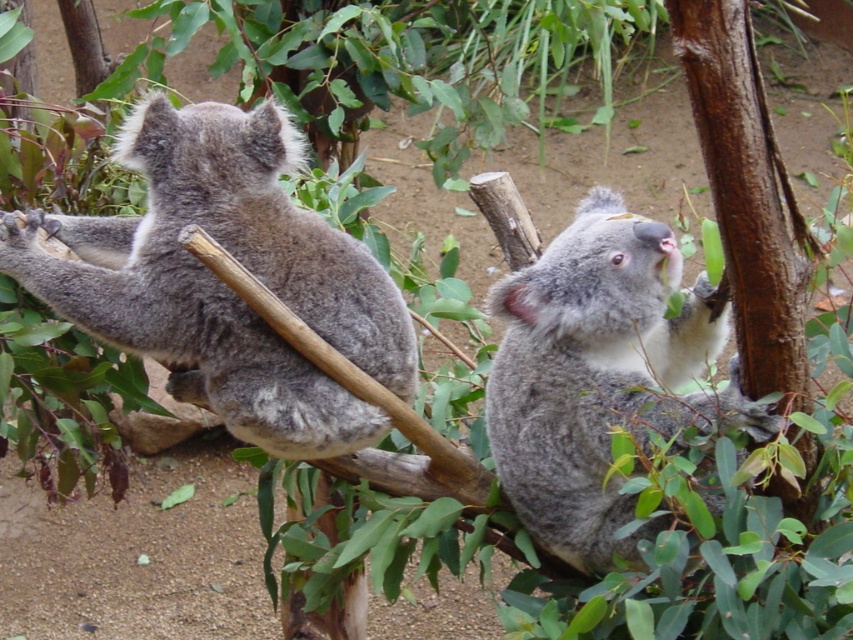
Question: Can you confirm if gray furry koala at left is thinner than fuzzy gray koala at upper right?

Choices:
 (A) yes
 (B) no

Answer: (B)

Question: Which of the following is the farthest from the observer?

Choices:
 (A) fuzzy gray koala at upper right
 (B) gray furry koala at left

Answer: (B)

Question: Can you confirm if gray furry koala at left is wider than fuzzy gray koala at upper right?

Choices:
 (A) no
 (B) yes

Answer: (B)

Question: Is gray furry koala at left below fuzzy gray koala at upper right?

Choices:
 (A) no
 (B) yes

Answer: (A)